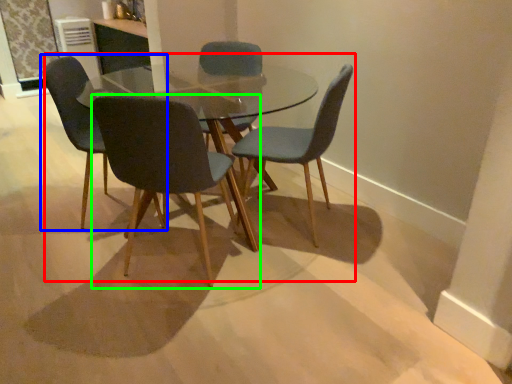
Question: Which is farther away from kitchen & dining room table (highlighted by a red box)? chair (highlighted by a blue box) or chair (highlighted by a green box)?

Choices:
 (A) chair
 (B) chair

Answer: (A)